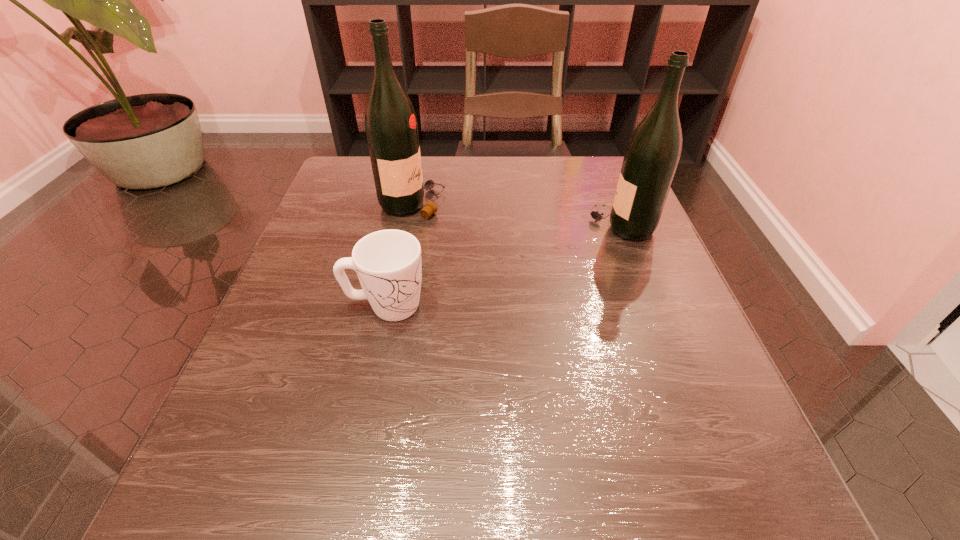
Find the location of a particular element. free space that satisfies the following two spatial constraints: 1. on the surface of the left wine bottle; 2. on the left side of the right wine bottle is located at coordinates (408, 226).

The image size is (960, 540). I want to click on vacant space that satisfies the following two spatial constraints: 1. on the surface of the left wine bottle; 2. on the back side of the right wine bottle, so 408,226.

Identify the location of free spot that satisfies the following two spatial constraints: 1. on the surface of the left wine bottle; 2. on the left side of the rightmost object. The height and width of the screenshot is (540, 960). pos(408,226).

Locate an element on the screen. The height and width of the screenshot is (540, 960). vacant point that satisfies the following two spatial constraints: 1. on the front side of the right wine bottle; 2. on the side of the shortest object with the handle is located at coordinates (653, 306).

Image resolution: width=960 pixels, height=540 pixels. I want to click on vacant point that satisfies the following two spatial constraints: 1. on the surface of the left wine bottle; 2. on the left side of the rightmost object, so click(408, 226).

What are the coordinates of `vacant space that satisfies the following two spatial constraints: 1. on the front side of the right wine bottle; 2. on the side of the nearest object with the handle` in the screenshot? It's located at (653, 306).

Locate an element on the screen. The height and width of the screenshot is (540, 960). free space that satisfies the following two spatial constraints: 1. on the surface of the left wine bottle; 2. on the left side of the rightmost object is located at coordinates (408, 226).

Find the location of `vacant space that satisfies the following two spatial constraints: 1. on the back side of the rightmost object; 2. on the surface of the left wine bottle`. vacant space that satisfies the following two spatial constraints: 1. on the back side of the rightmost object; 2. on the surface of the left wine bottle is located at coordinates (612, 204).